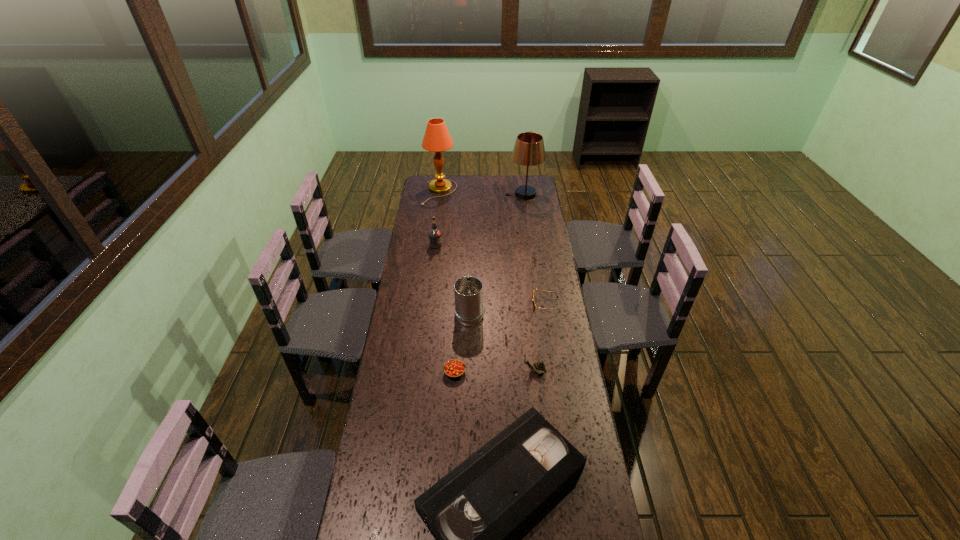
Identify the location of empty space between the strawberry and the sunglasses. (500, 338).

This screenshot has height=540, width=960. What are the coordinates of `blank region between the sunglasses and the strawberry` in the screenshot? It's located at (500, 338).

Locate an element on the screen. Image resolution: width=960 pixels, height=540 pixels. the fourth closest object relative to the nearest object is located at coordinates coord(534,305).

Locate which object is the seventh closest to the lampshade. Please provide its 2D coordinates. Your answer should be formatted as a tuple, i.e. [(x, y)], where the tuple contains the x and y coordinates of a point satisfying the conditions above.

[(473, 512)]